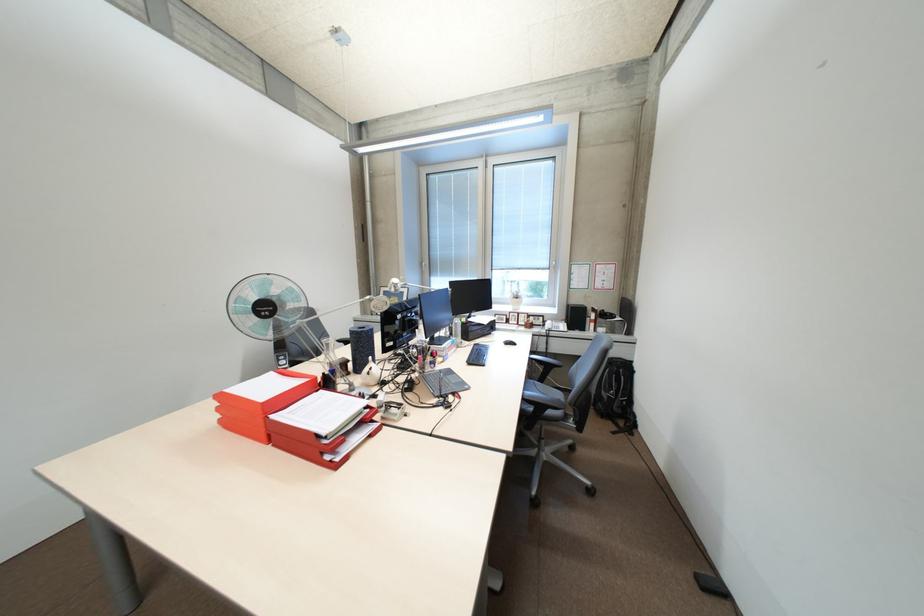
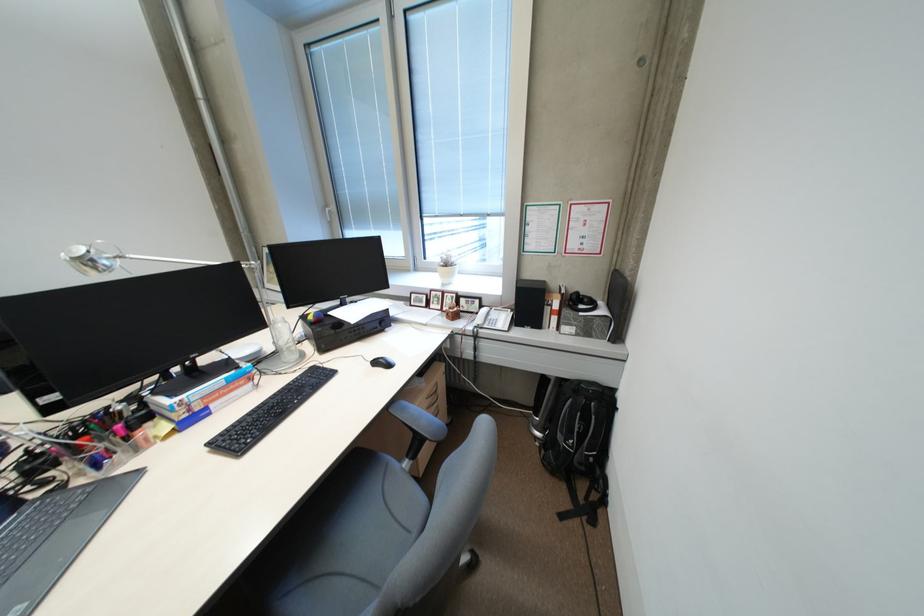
Locate, in the second image, the point that corresponds to [586,315] in the first image.

(538, 302)